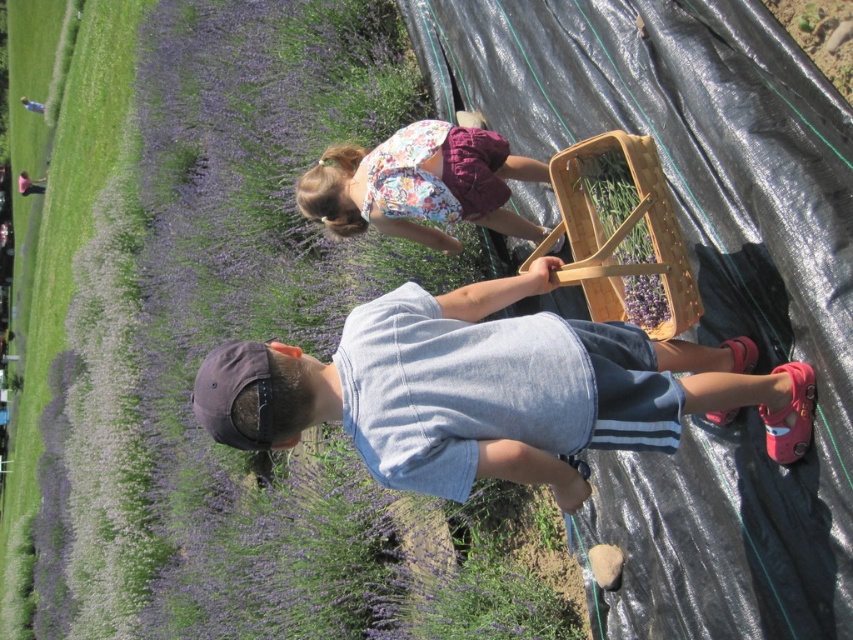
Which is more to the left, denim shorts at center or floral fabric dress at center?

From the viewer's perspective, floral fabric dress at center appears more on the left side.

Does point (587, 358) come behind point (430, 141)?

No, (587, 358) is in front of (430, 141).

You are a GUI agent. You are given a task and a screenshot of the screen. Output one action in this format:
    pyautogui.click(x=<x>, y=<y>)
    Task: Click on the denim shorts at center
    
    Given the screenshot: What is the action you would take?
    pyautogui.click(x=491, y=390)

Based on the photo, can you confirm if purple soft lavender at upper left is positioned to the right of denim shorts at center?

In fact, purple soft lavender at upper left is to the left of denim shorts at center.

Does point (241, 3) lie in front of point (492, 324)?

No.

At what (x,y) coordinates should I click in order to perform the action: click on purple soft lavender at upper left. Please return your answer as a coordinate pair (x, y). This screenshot has width=853, height=640. Looking at the image, I should click on (230, 337).

Which of these two, purple soft lavender at upper left or floral fabric dress at center, stands taller?

purple soft lavender at upper left

Does purple soft lavender at upper left have a lesser width compared to floral fabric dress at center?

Incorrect, purple soft lavender at upper left's width is not less than floral fabric dress at center's.

Who is more forward, (209, 314) or (488, 134)?

Point (488, 134) is more forward.

The width and height of the screenshot is (853, 640). In order to click on purple soft lavender at upper left in this screenshot , I will do `click(230, 337)`.